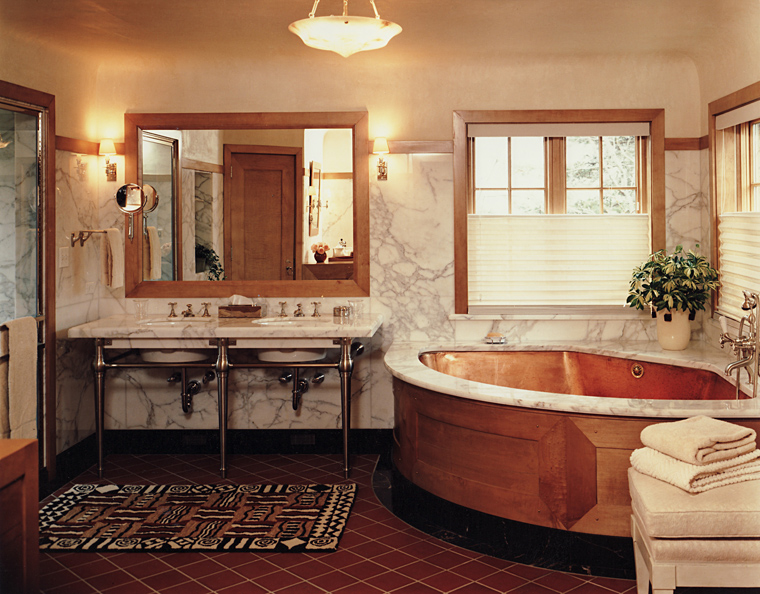
This screenshot has height=594, width=760. Identify the location of sink. (176, 353), (280, 352).